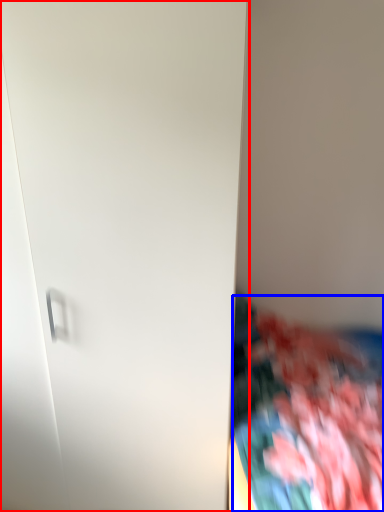
Question: Which object appears farthest to the camera in this image, door (highlighted by a red box) or textile (highlighted by a blue box)?

Choices:
 (A) door
 (B) textile

Answer: (A)